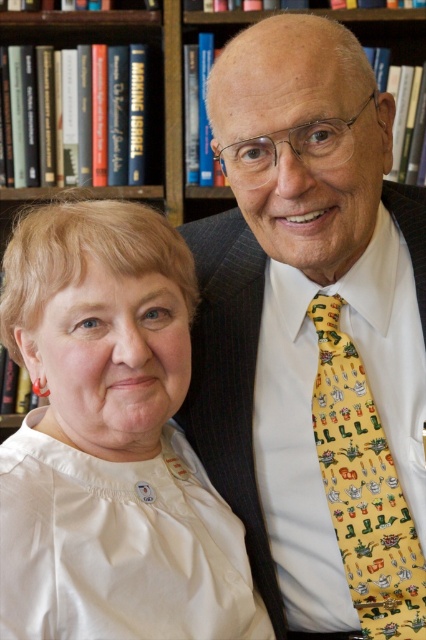
Question: Is yellow printed tie at right below wooden bookshelf at upper center?

Choices:
 (A) no
 (B) yes

Answer: (B)

Question: Which point is farther to the camera?

Choices:
 (A) (109, 525)
 (B) (180, 154)

Answer: (B)

Question: Is yellow printed tie at center positioned at the back of wooden bookshelf at upper center?

Choices:
 (A) no
 (B) yes

Answer: (B)

Question: Is white satin blouse at left in front of yellow printed tie at center?

Choices:
 (A) yes
 (B) no

Answer: (A)

Question: Which point is closer to the camera?

Choices:
 (A) (363, 529)
 (B) (198, 362)

Answer: (A)

Question: Which object is the farthest from the wooden bookshelf at upper center?

Choices:
 (A) yellow printed tie at right
 (B) yellow printed tie at center

Answer: (B)